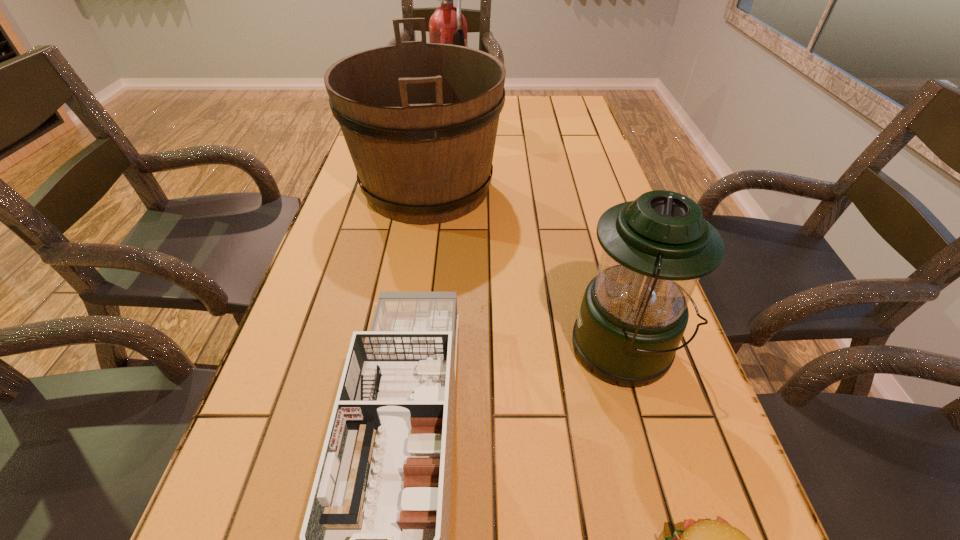
Locate an element on the screen. Image resolution: width=960 pixels, height=540 pixels. the farthest object is located at coordinates (447, 25).

This screenshot has height=540, width=960. Find the location of `bucket`. bucket is located at coordinates (420, 120).

Identify the location of lantern. This screenshot has height=540, width=960. (634, 312).

You are a GUI agent. You are given a task and a screenshot of the screen. Output one action in this format:
    pyautogui.click(x=<x>, y=<y>)
    Task: Click on the vacant point located on the front of the farthest object near the operation label
    The height and width of the screenshot is (540, 960).
    Given the screenshot: What is the action you would take?
    click(x=495, y=111)

Locate an element on the screen. This screenshot has height=540, width=960. vacant space located 0.330m on the right of the fourth nearest object is located at coordinates (616, 188).

Where is `vacant region located 0.310m on the left of the third tallest object`? The height and width of the screenshot is (540, 960). vacant region located 0.310m on the left of the third tallest object is located at coordinates (413, 349).

In order to click on object that is at the far edge in this screenshot , I will do `click(447, 25)`.

Where is `object present at the left edge`? object present at the left edge is located at coordinates (420, 120).

The image size is (960, 540). In order to click on object located at the right edge in this screenshot , I will do `click(634, 312)`.

The height and width of the screenshot is (540, 960). Identify the location of vacant position at the left edge of the desktop. (354, 260).